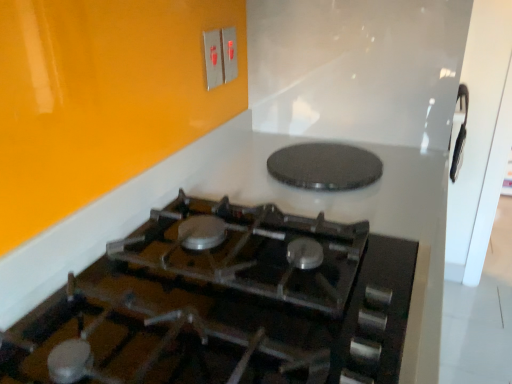
Question: Does black textured pizza pan at upper center have a larger size compared to black glass gas stove at center?

Choices:
 (A) no
 (B) yes

Answer: (A)

Question: Is black textured pizza pan at upper center behind black glass gas stove at center?

Choices:
 (A) yes
 (B) no

Answer: (A)

Question: Considering the relative sizes of black textured pizza pan at upper center and black glass gas stove at center in the image provided, is black textured pizza pan at upper center smaller than black glass gas stove at center?

Choices:
 (A) no
 (B) yes

Answer: (B)

Question: Is black textured pizza pan at upper center to the left of black glass gas stove at center from the viewer's perspective?

Choices:
 (A) no
 (B) yes

Answer: (A)

Question: Does black textured pizza pan at upper center have a lesser width compared to black glass gas stove at center?

Choices:
 (A) no
 (B) yes

Answer: (B)

Question: Is black glass gas stove at center wider or thinner than metallic silver switch at upper center, marked as the 2th electric outlet in a left-to-right arrangement?

Choices:
 (A) thin
 (B) wide

Answer: (B)

Question: In the image, is black glass gas stove at center positioned in front of or behind metallic silver switch at upper center, placed as the 1th electric outlet when sorted from right to left?

Choices:
 (A) behind
 (B) front

Answer: (B)

Question: Considering the positions of black glass gas stove at center and metallic silver switch at upper center, placed as the 1th electric outlet when sorted from right to left, in the image, is black glass gas stove at center taller or shorter than metallic silver switch at upper center, placed as the 1th electric outlet when sorted from right to left,?

Choices:
 (A) tall
 (B) short

Answer: (B)

Question: Is black glass gas stove at center spatially inside metallic silver switch at upper center, placed as the 1th electric outlet when sorted from right to left, or outside of it?

Choices:
 (A) outside
 (B) inside

Answer: (A)

Question: From a real-world perspective, is black textured pizza pan at upper center physically located above or below metallic silver switch at upper center, placed as the 1th electric outlet when sorted from right to left?

Choices:
 (A) below
 (B) above

Answer: (A)

Question: From the image's perspective, is black textured pizza pan at upper center positioned above or below metallic silver switch at upper center, placed as the 1th electric outlet when sorted from right to left?

Choices:
 (A) below
 (B) above

Answer: (A)

Question: Looking at the image, does black textured pizza pan at upper center seem bigger or smaller compared to metallic silver switch at upper center, placed as the 1th electric outlet when sorted from right to left?

Choices:
 (A) big
 (B) small

Answer: (A)

Question: Choose the correct answer: Is black textured pizza pan at upper center inside metallic silver switch at upper center, placed as the 1th electric outlet when sorted from right to left, or outside it?

Choices:
 (A) outside
 (B) inside

Answer: (A)

Question: Is metallic silver switch at upper center, placed as the 1th electric outlet when sorted from right to left, wider or thinner than metallic switch at upper center, which is the 2th electric outlet from right to left?

Choices:
 (A) thin
 (B) wide

Answer: (A)

Question: Is metallic silver switch at upper center, placed as the 1th electric outlet when sorted from right to left, to the left or to the right of metallic switch at upper center, which is counted as the first electric outlet, starting from the left, in the image?

Choices:
 (A) right
 (B) left

Answer: (A)